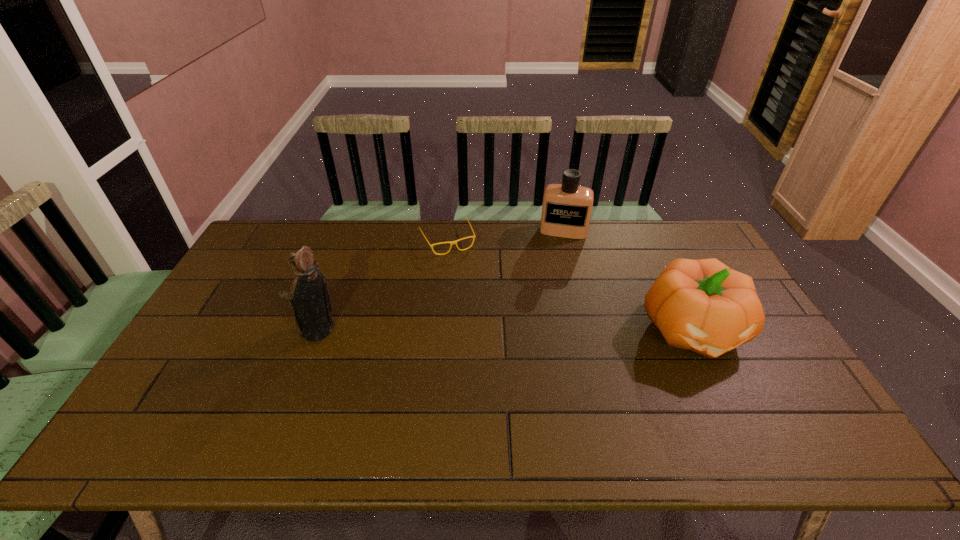
Locate an element on the screen. The width and height of the screenshot is (960, 540). vacant space at the near edge of the desktop is located at coordinates (672, 404).

In the image, there is a desktop. Where is `free space at the right edge`? The image size is (960, 540). free space at the right edge is located at coordinates (779, 372).

Find the location of a particular element. This screenshot has height=540, width=960. vacant space at the far left corner of the desktop is located at coordinates (281, 241).

Image resolution: width=960 pixels, height=540 pixels. In order to click on vacant space at the far right corner in this screenshot , I will do click(x=697, y=254).

In the image, there is a desktop. At what (x,y) coordinates should I click in order to perform the action: click on vacant space at the near right corner. Please return your answer as a coordinate pair (x, y). Looking at the image, I should click on (784, 399).

Where is `free spot between the rightmost object and the leftmost object`? free spot between the rightmost object and the leftmost object is located at coordinates (505, 330).

You are a GUI agent. You are given a task and a screenshot of the screen. Output one action in this format:
    pyautogui.click(x=<x>, y=<y>)
    Task: Click on the unoccupied area between the rightmost object and the figurine
    Image resolution: width=960 pixels, height=540 pixels.
    Given the screenshot: What is the action you would take?
    [x=505, y=330]

The height and width of the screenshot is (540, 960). In order to click on vacant space that is in between the figurine and the perfume in this screenshot , I will do `click(441, 281)`.

Where is `unoccupied area between the spectacles and the tallest object`? The image size is (960, 540). unoccupied area between the spectacles and the tallest object is located at coordinates point(382,285).

Where is `vacant space that is in between the perfume and the rightmost object`? The width and height of the screenshot is (960, 540). vacant space that is in between the perfume and the rightmost object is located at coordinates (628, 280).